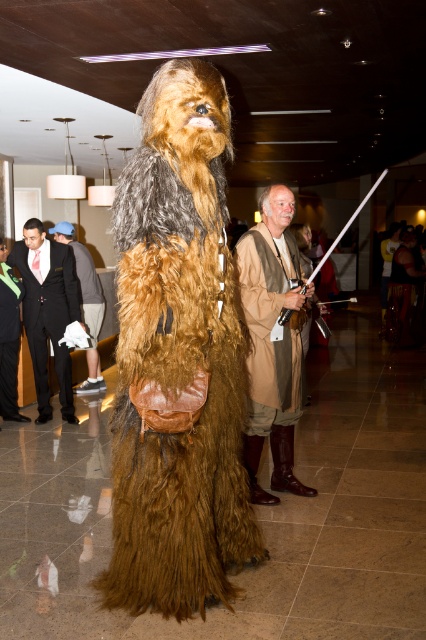
Between brown leather boots at lower center and dark gray suit at left, which one has less height?

With less height is dark gray suit at left.

Is brown leather boots at lower center to the right of dark gray suit at left from the viewer's perspective?

Correct, you'll find brown leather boots at lower center to the right of dark gray suit at left.

Between point (259, 324) and point (86, 364), which one is positioned behind?

Point (86, 364)

Where is `brown leather boots at lower center`? The height and width of the screenshot is (640, 426). brown leather boots at lower center is located at coordinates (271, 340).

Can you confirm if brown leather boots at lower center is shorter than green satin tie at lower left?

No, brown leather boots at lower center is not shorter than green satin tie at lower left.

Between brown leather boots at lower center and green satin tie at lower left, which one appears on the right side from the viewer's perspective?

brown leather boots at lower center

Between point (238, 260) and point (5, 385), which one is positioned behind?

Point (5, 385)

The image size is (426, 640). In order to click on brown leather boots at lower center in this screenshot , I will do `click(271, 340)`.

Can you confirm if brown furry costume at center is positioned below brown leather boots at lower center?

No.

Between point (218, 252) and point (264, 413), which one is positioned in front?

Point (218, 252)

Image resolution: width=426 pixels, height=640 pixels. Find the location of `brown furry costume at center`. brown furry costume at center is located at coordinates (178, 358).